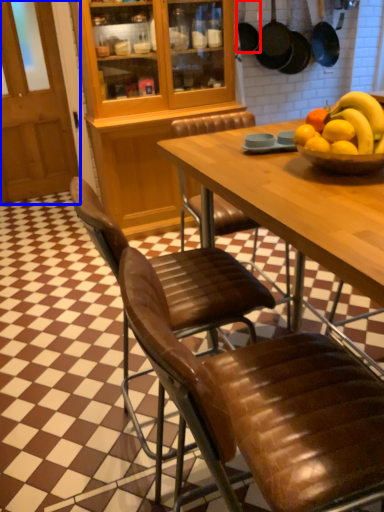
Question: Among these objects, which one is nearest to the camera, frying pan (highlighted by a red box) or glass door (highlighted by a blue box)?

Choices:
 (A) frying pan
 (B) glass door

Answer: (B)